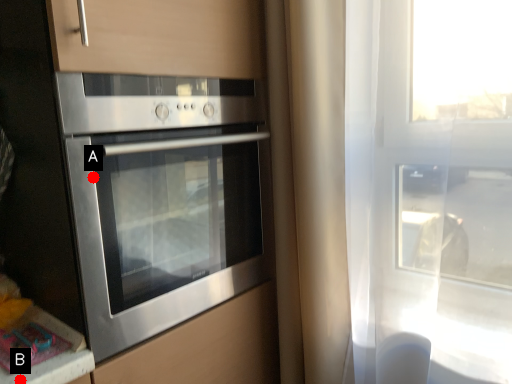
Question: Two points are circled on the image, labeled by A and B beside each circle. Among these points, which one is nearest to the camera?

Choices:
 (A) A is closer
 (B) B is closer

Answer: (B)